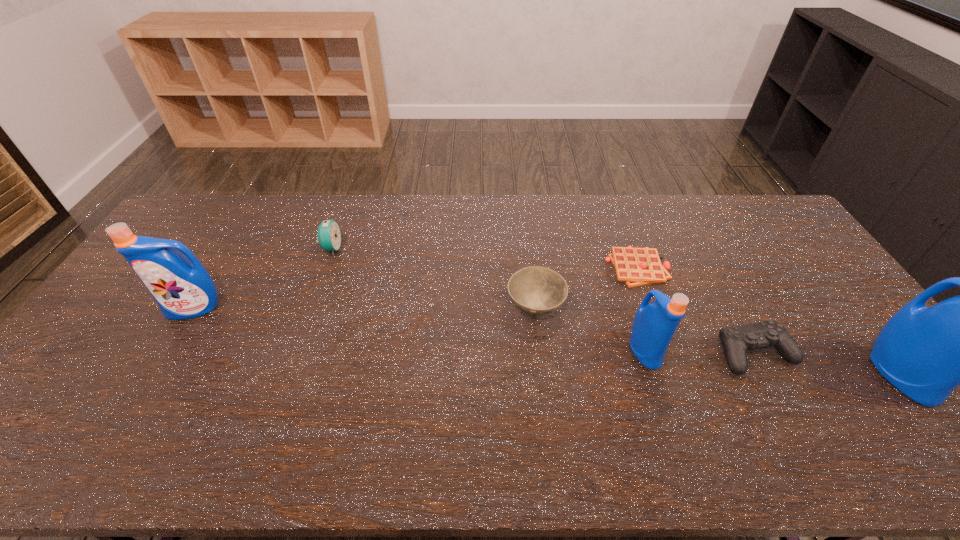
If equal spacing is the goal by inserting an additional detergent among them, please point out a vacant space for this new detergent. Please provide its 2D coordinates. Your answer should be formatted as a tuple, i.e. [(x, y)], where the tuple contains the x and y coordinates of a point satisfying the conditions above.

[(410, 329)]